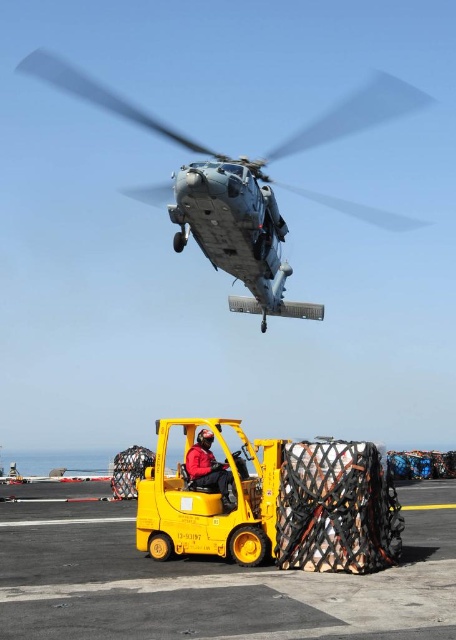
Question: Can you confirm if metallic gray helicopter at upper center is thinner than red fabric jacket at center?

Choices:
 (A) no
 (B) yes

Answer: (A)

Question: Which point is farther from the camera taking this photo?

Choices:
 (A) pos(243,468)
 (B) pos(151,195)

Answer: (B)

Question: Does metallic gray helicopter at upper center have a greater width compared to red fabric jacket at center?

Choices:
 (A) yes
 (B) no

Answer: (A)

Question: Which of the following is the closest to the observer?

Choices:
 (A) (239, 458)
 (B) (255, 227)

Answer: (A)

Question: Can you confirm if metallic gray helicopter at upper center is smaller than red fabric jacket at center?

Choices:
 (A) yes
 (B) no

Answer: (B)

Question: Which point is closer to the camera?

Choices:
 (A) (195, 461)
 (B) (245, 204)

Answer: (A)